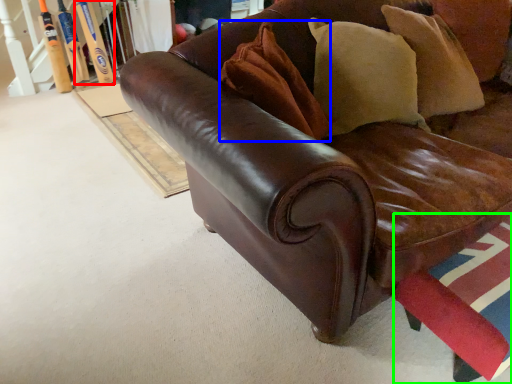
Question: Considering the real-world distances, which object is farthest from baseball bat (highlighted by a red box)? pillow (highlighted by a blue box) or swivel chair (highlighted by a green box)?

Choices:
 (A) pillow
 (B) swivel chair

Answer: (B)